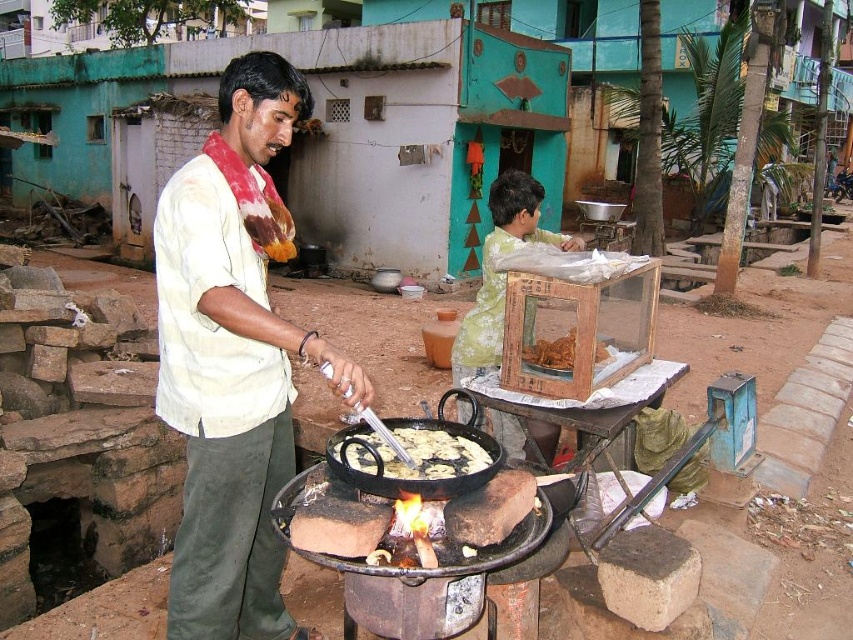
From the picture: You are a customer observing the street food vendor. You notice the light beige shirt at center and the brown crispy fried food at center. Which object takes up more space in the image?

The light beige shirt at center is larger in size than the brown crispy fried food at center, so the light beige shirt at center takes up more space in the image.

You are a customer at the food stall and want to take a photo of both the golden crispy flatbread at center and the brown crispy fried food at center. Which one will appear larger in your photo?

The golden crispy flatbread at center will appear larger in your photo because it is closer to the viewer than the brown crispy fried food at center.

You are a customer at the street food vendor. You want to choose the larger item between the golden crispy flatbread at center and the brown crispy fried food at center. Which one should you pick?

The brown crispy fried food at center is larger than the golden crispy flatbread at center, so you should pick the brown crispy fried food at center.